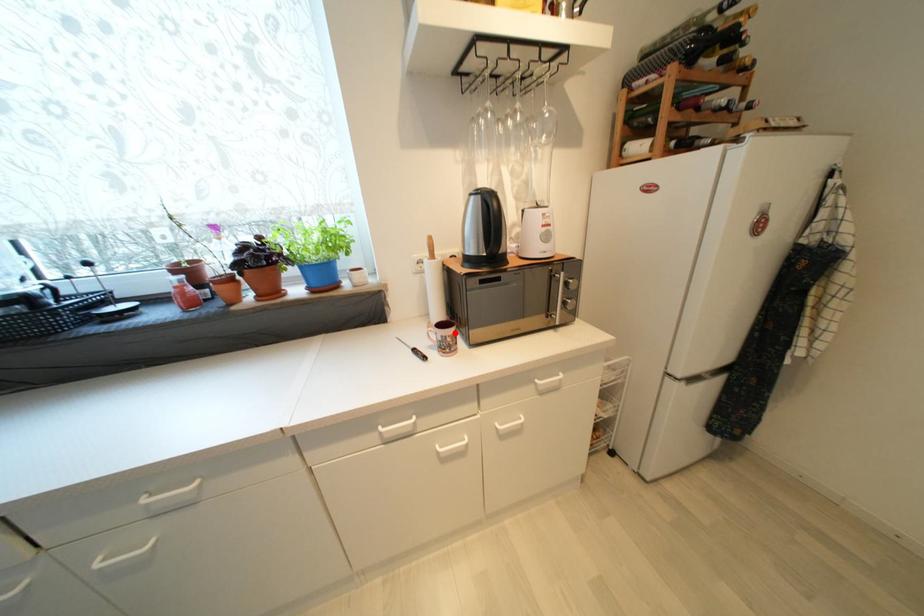
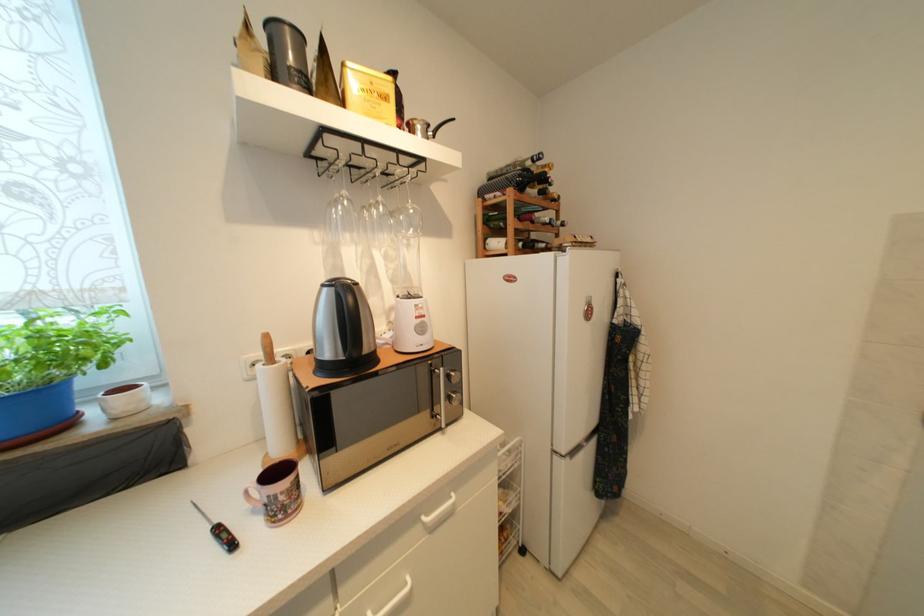
Find the pixel in the second image that matches the highlighted location in the first image.

(289, 485)